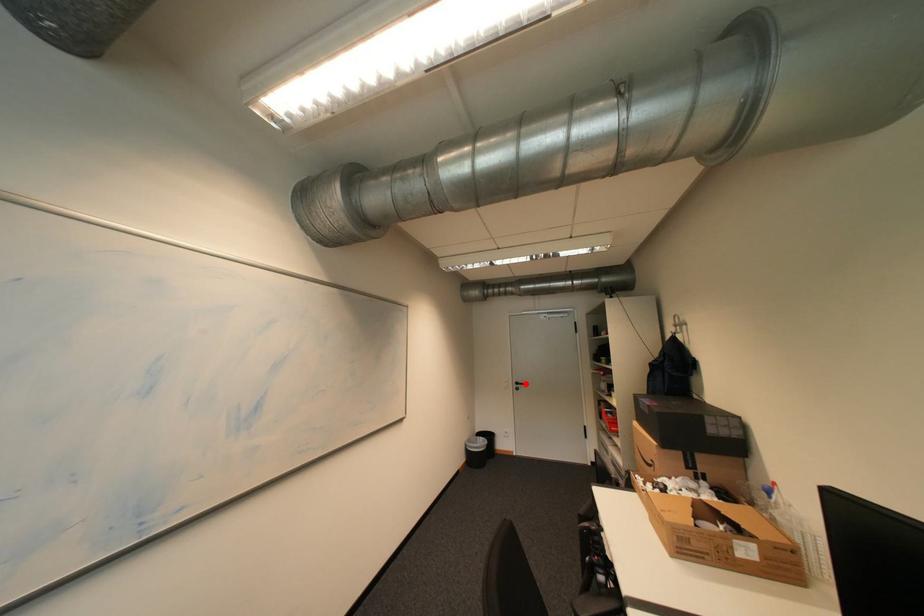
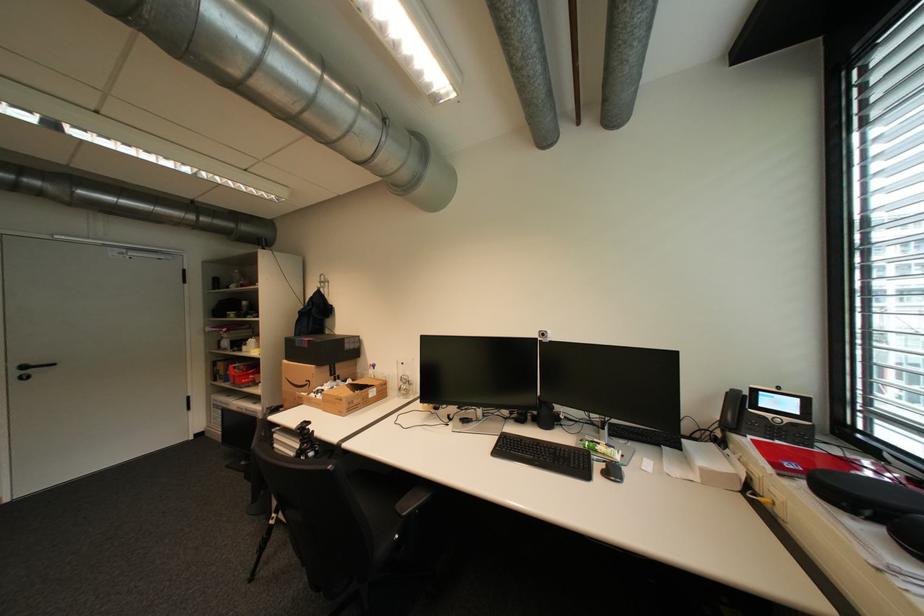
Find the pixel in the second image that matches the highlighted location in the first image.

(32, 368)